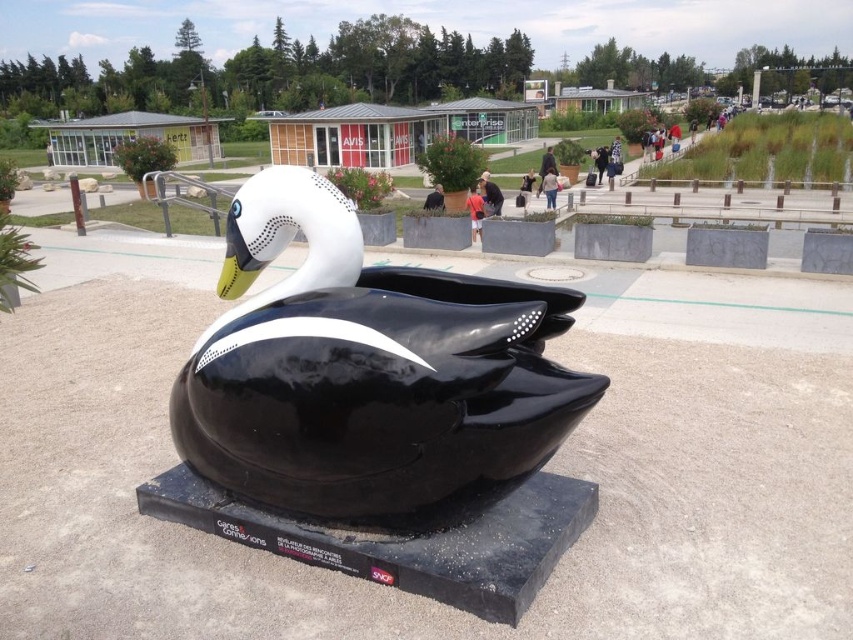
You are standing in the plaza and want to take a photo of the glossy black duck at center. If your camera can focus on objects up to 10 feet away, will you be able to take a clear photo from your current position?

The glossy black duck at center and viewer are 9.73 feet apart from each other. Since the camera can focus up to 10 feet away, you can take a clear photo from your current position.